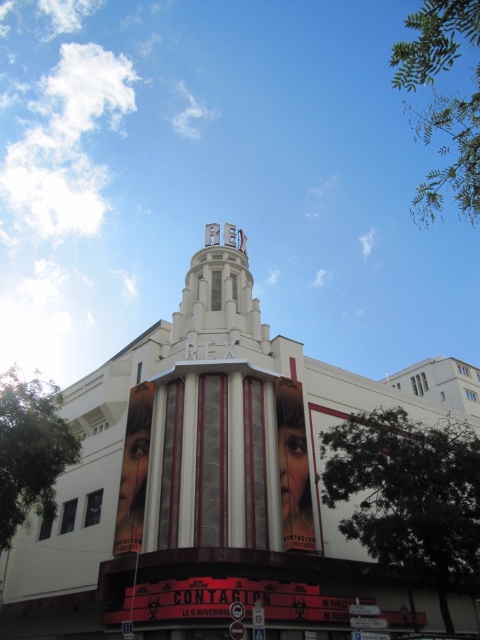
Based on the image description, what does the point at coordinates (213, 481) represent?

The point at coordinates (213, 481) corresponds to the white and smooth theater at the center.